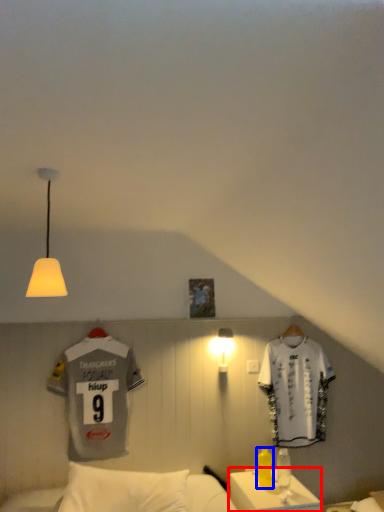
Question: Which object appears farthest to the camera in this image, table (highlighted by a red box) or bottle (highlighted by a blue box)?

Choices:
 (A) table
 (B) bottle

Answer: (B)